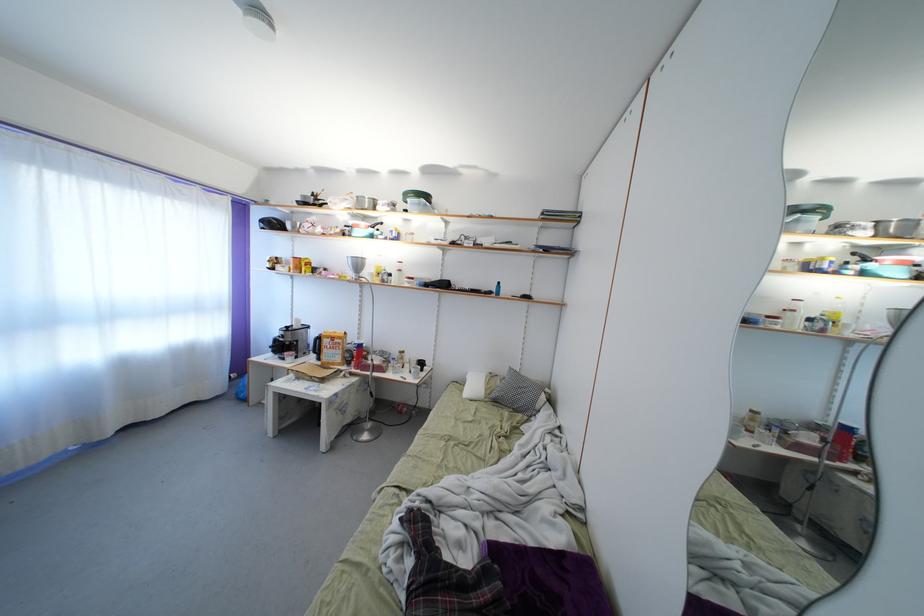
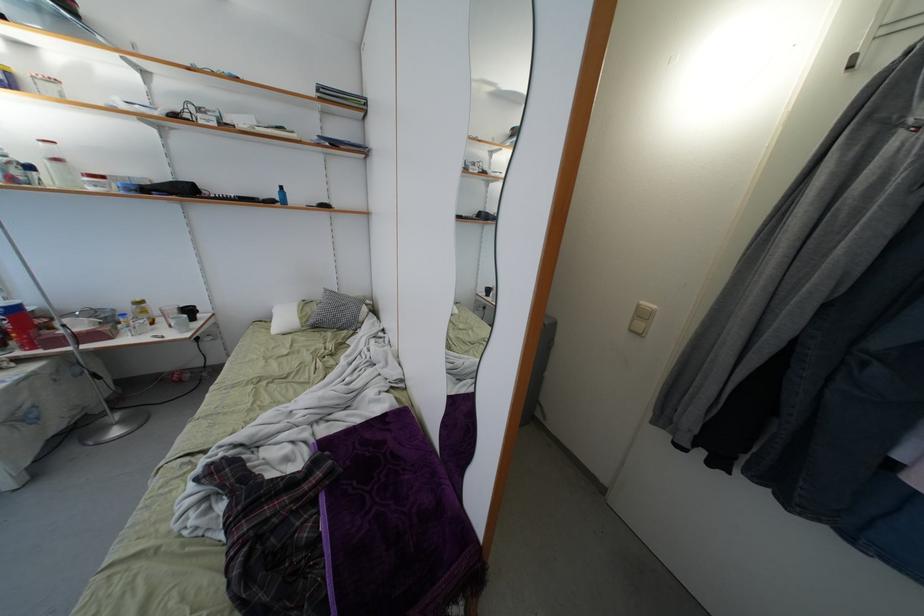
In the second image, find the point that corresponds to (419,284) in the first image.

(110, 184)